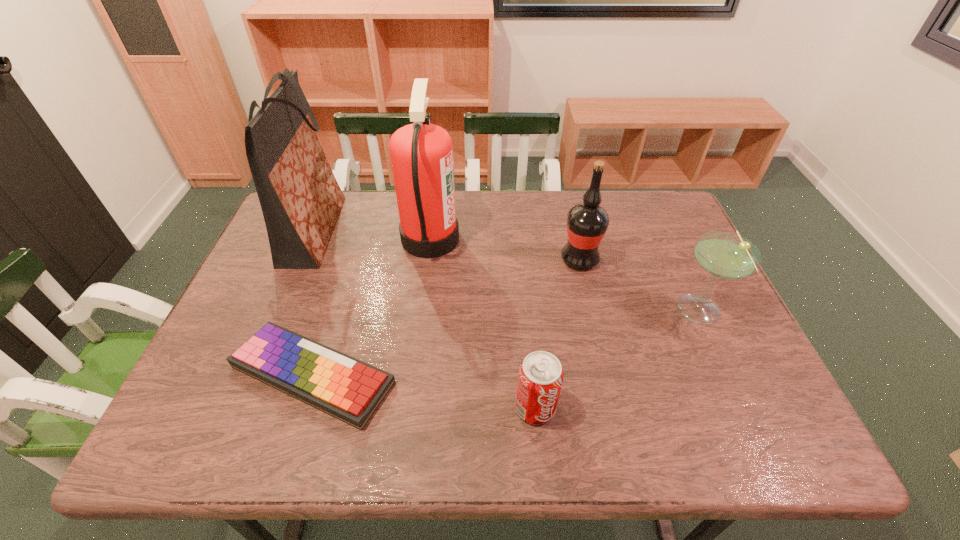
You are a GUI agent. You are given a task and a screenshot of the screen. Output one action in this format:
    pyautogui.click(x=<x>, y=<y>)
    Task: Click on the vacant space that satisfies the following two spatial constraints: 1. at the nozzle of the fire extinguisher; 2. on the right side of the fifth object from left to right
    The width and height of the screenshot is (960, 540).
    Given the screenshot: What is the action you would take?
    pyautogui.click(x=428, y=259)

Find the location of a particular element. vacant space that satisfies the following two spatial constraints: 1. on the front-facing side of the third object from right to left; 2. on the left side of the shopping bag is located at coordinates (242, 408).

This screenshot has width=960, height=540. Find the location of `vacant area that satisfies the following two spatial constraints: 1. on the front-facing side of the computer keyboard; 2. on the left side of the shopping bag`. vacant area that satisfies the following two spatial constraints: 1. on the front-facing side of the computer keyboard; 2. on the left side of the shopping bag is located at coordinates (255, 375).